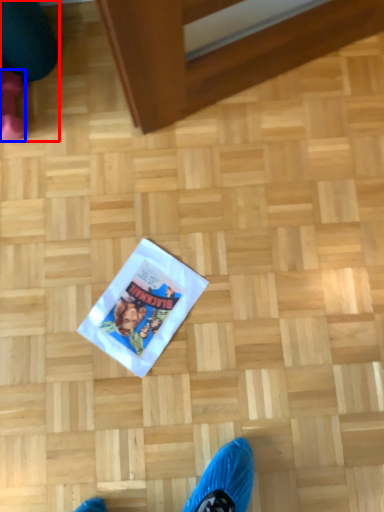
Question: Which of the following is the farthest to the observer, leg (highlighted by a red box) or footwear (highlighted by a blue box)?

Choices:
 (A) leg
 (B) footwear

Answer: (B)